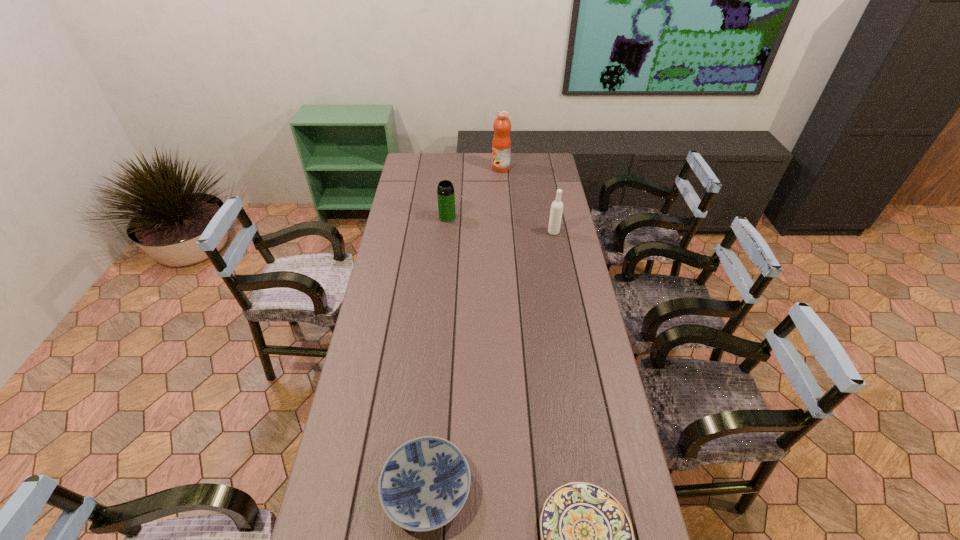
What are the coordinates of `fruit juice` in the screenshot? It's located at (501, 145).

In order to click on the farthest object in this screenshot , I will do `click(501, 145)`.

This screenshot has height=540, width=960. What are the coordinates of `vodka` in the screenshot? It's located at (556, 211).

Image resolution: width=960 pixels, height=540 pixels. I want to click on thermos bottle, so click(x=445, y=193).

This screenshot has height=540, width=960. I want to click on the second shortest object, so click(x=424, y=484).

Find the location of `the left plate`. the left plate is located at coordinates (424, 484).

Where is `vacant region located on the front label of the fruit juice`? This screenshot has width=960, height=540. vacant region located on the front label of the fruit juice is located at coordinates (472, 168).

Identify the location of free location located on the front label of the fruit juice. (444, 168).

At what (x,y) coordinates should I click in order to perform the action: click on free location located on the front label of the fruit juice. Please return your answer as a coordinate pair (x, y). The image size is (960, 540). Looking at the image, I should click on (418, 168).

Identify the location of vacant space situated on the back of the vodka. The width and height of the screenshot is (960, 540). (550, 215).